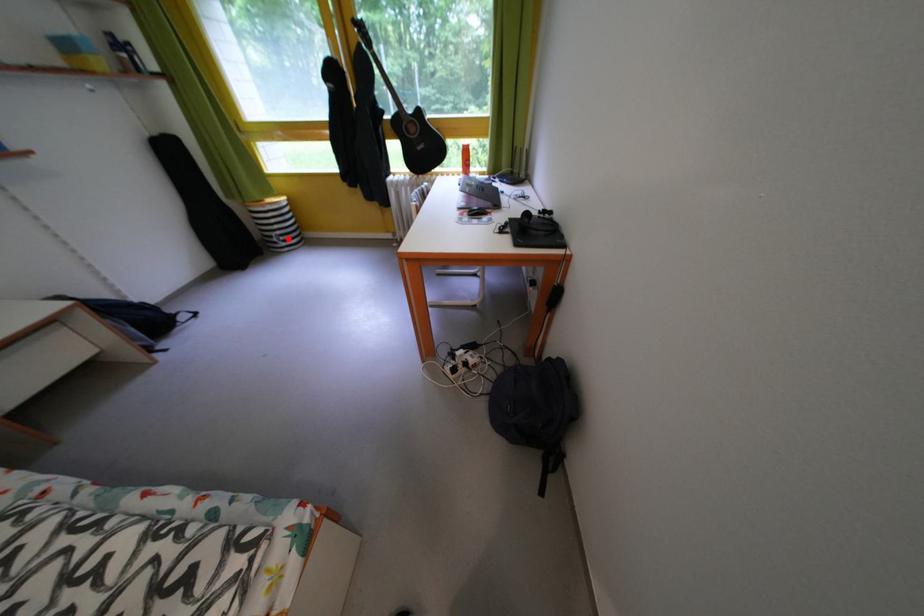
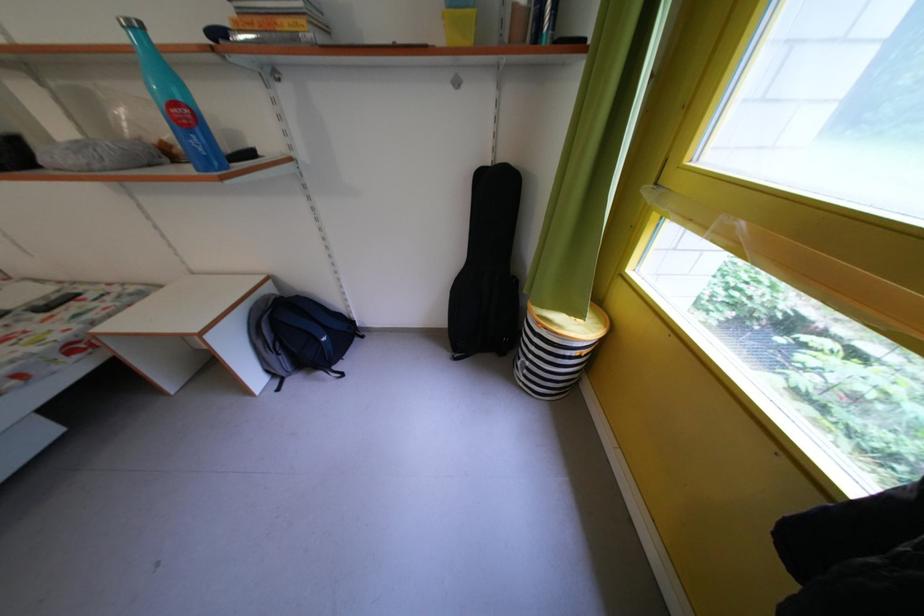
Question: I am providing you with two images of the same scene from different viewpoints. A red point is marked on the first image. At the location where the point appears in image 1, is it still visible in image 2?

Choices:
 (A) Yes
 (B) No

Answer: (A)